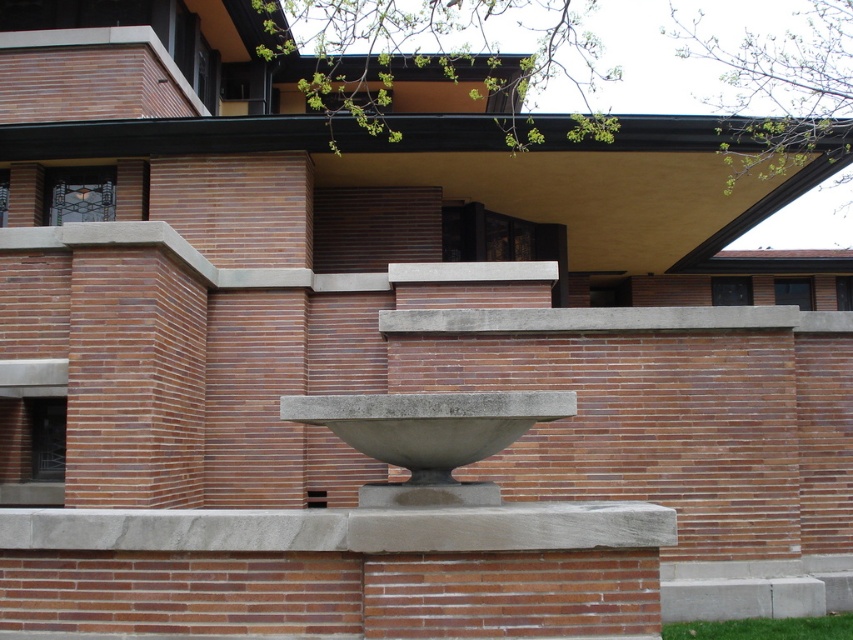
Who is more forward, (618, 545) or (508, 406)?

Positioned in front is point (618, 545).

Between gray concrete ledge at center and gray concrete bowl at center, which one appears on the left side from the viewer's perspective?

gray concrete ledge at center

At what (x,y) coordinates should I click in order to perform the action: click on gray concrete ledge at center. Please return your answer as a coordinate pair (x, y). Looking at the image, I should click on (344, 529).

Where is `gray concrete ledge at center`? The width and height of the screenshot is (853, 640). gray concrete ledge at center is located at coordinates (344, 529).